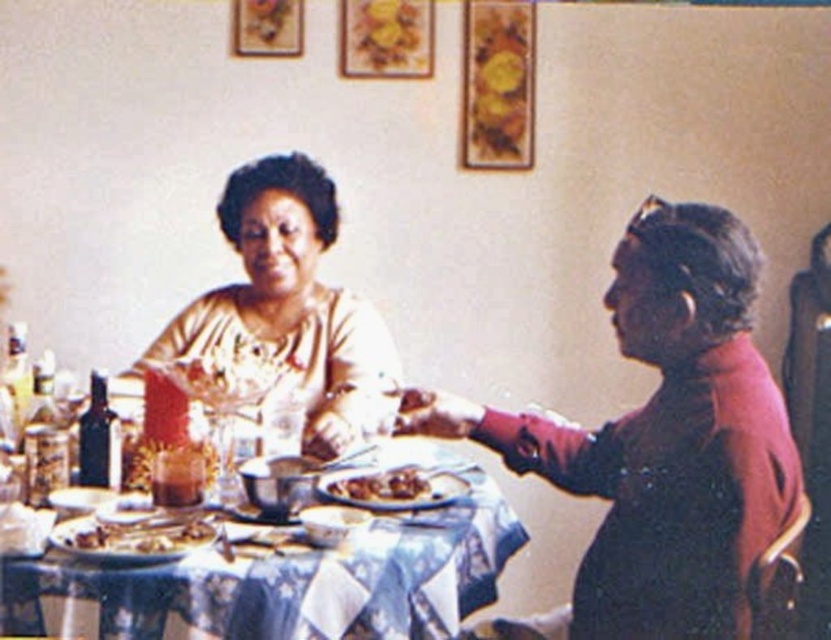
You are a server in a historical dining room and need to place a 12 inch long platter between the matte gold dress at center and the shiny brown meat at center. Can the platter fit between them without overlapping either object?

The distance between the matte gold dress at center and the shiny brown meat at center is 13.17 inches. Since the platter is 12 inches long, there is enough space for it to fit between them without overlapping either object.

You are a guest at this dining table and want to know which of the two gold items is closer to you. The items are the matte gold dress at center and the gold textured blouse at upper left. Can you determine which one is taller?

The matte gold dress at center is taller than the gold textured blouse at upper left, so the matte gold dress at center is closer to you.

What are the coordinates of the matte gold dress at center in the image?

The coordinates of the matte gold dress at center are at point (546,416).